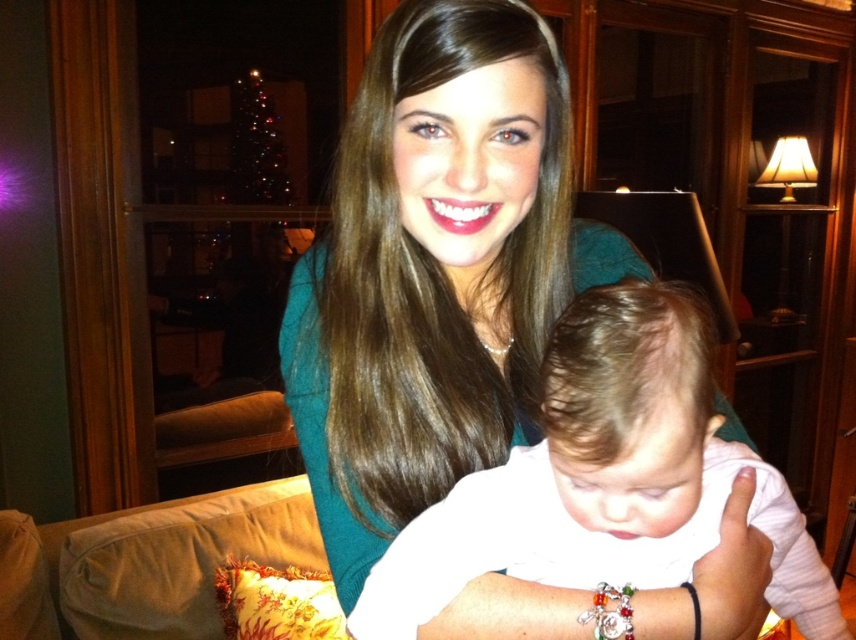
What do you see at coordinates (435, 269) in the screenshot? The image size is (856, 640). I see `matte teal sweater at center` at bounding box center [435, 269].

Can you confirm if matte teal sweater at center is wider than white soft baby at center?

Correct, the width of matte teal sweater at center exceeds that of white soft baby at center.

Is point (533, 355) farther from camera compared to point (423, 538)?

That is True.

Image resolution: width=856 pixels, height=640 pixels. Identify the location of matte teal sweater at center. (435, 269).